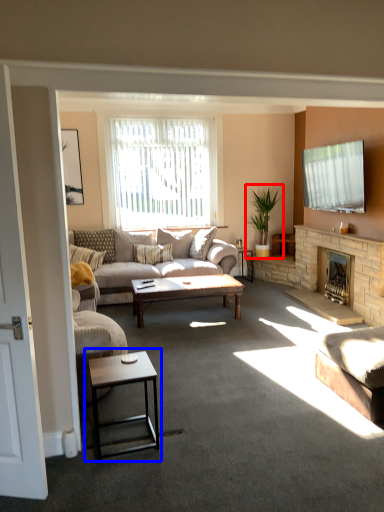
Question: Which object appears farthest to the camera in this image, houseplant (highlighted by a red box) or coffee table (highlighted by a blue box)?

Choices:
 (A) houseplant
 (B) coffee table

Answer: (A)